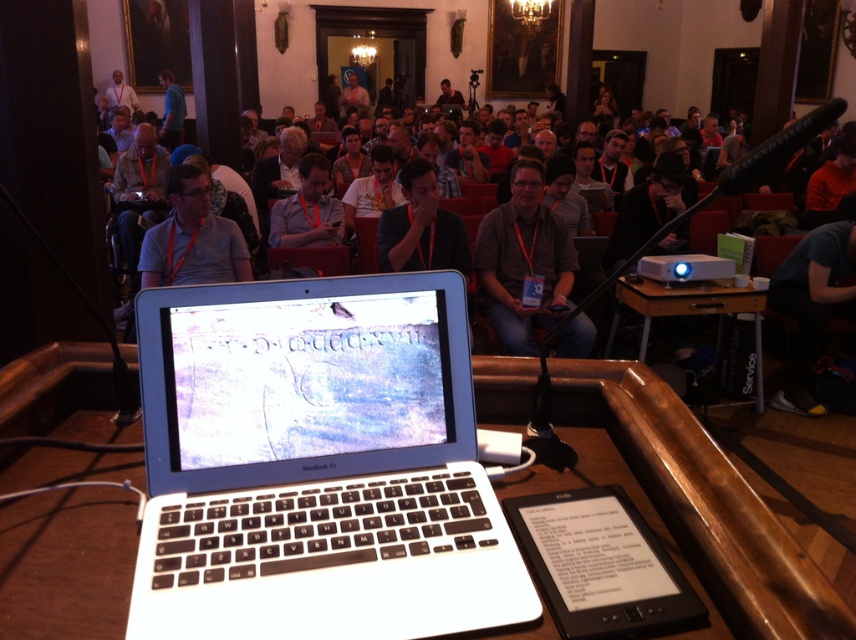
You are sitting in the front row of the room and want to hand a document to the person sitting directly in front of you. The person is wearing a matte gray shirt at center. However, there is a white plastic laptop at center blocking your path. Can you reach the person without moving the laptop?

The white plastic laptop at center is closer to the viewer than the matte gray shirt at center, so the laptop is blocking the direct path to the person. You would need to move the laptop to reach them.

You are sitting in the ornate room and want to reach the white plastic laptop at center to adjust its screen. Considering your arm length is 24 inches, can you comfortably reach it without moving your chair?

The white plastic laptop at center is 28.79 inches away from you, which is beyond your arm length of 24 inches. Therefore, you cannot comfortably reach it without moving your chair.